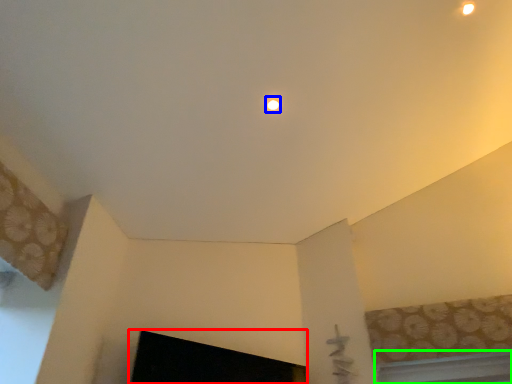
Question: Which is nearer to the fireplace (highlighted by a red box)? lighting (highlighted by a blue box) or window (highlighted by a green box).

Choices:
 (A) lighting
 (B) window

Answer: (B)